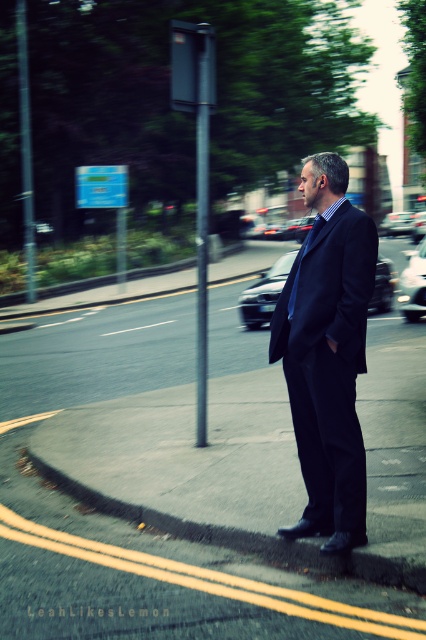
Question: Can you confirm if dark blue suit at center is thinner than shiny black car at center?

Choices:
 (A) no
 (B) yes

Answer: (B)

Question: Is silver metallic pole at center closer to camera compared to metallic silver sedan at center?

Choices:
 (A) yes
 (B) no

Answer: (A)

Question: Does silver metallic pole at center appear on the left side of metallic silver sedan at center?

Choices:
 (A) no
 (B) yes

Answer: (B)

Question: Which object is farther from the camera taking this photo?

Choices:
 (A) black satin tie at center
 (B) concrete at lower right
 (C) silver metallic pole at center

Answer: (C)

Question: Which point is farther to the camera?

Choices:
 (A) metallic gray pole at left
 (B) shiny black car at center

Answer: (A)

Question: Which is farther from the silver metallic pole at center?

Choices:
 (A) metallic silver car at center
 (B) metallic silver sedan at center
 (C) dark blue suit at center
 (D) black satin tie at center

Answer: (B)